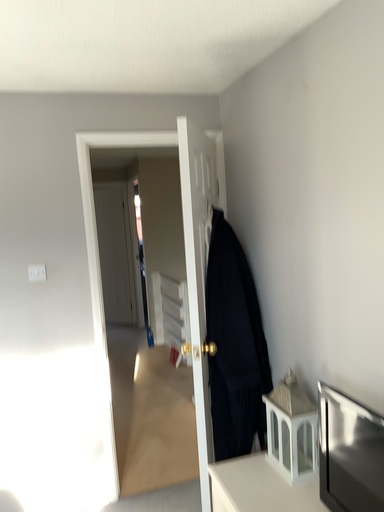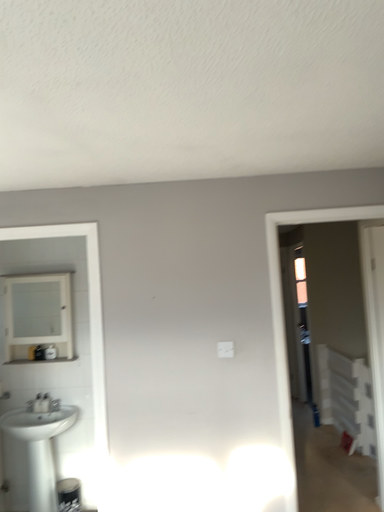
Question: How did the camera likely rotate when shooting the video?

Choices:
 (A) rotated left
 (B) rotated right

Answer: (A)